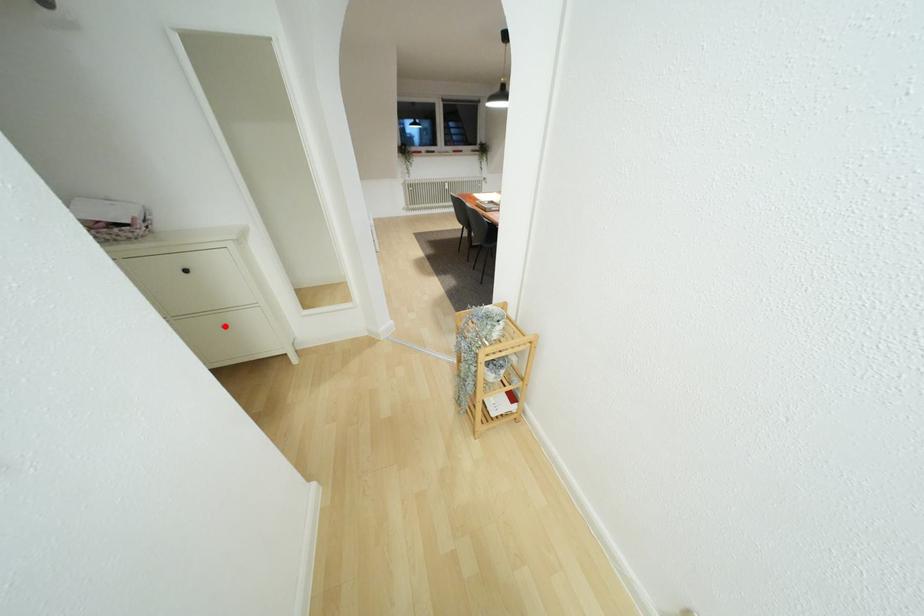
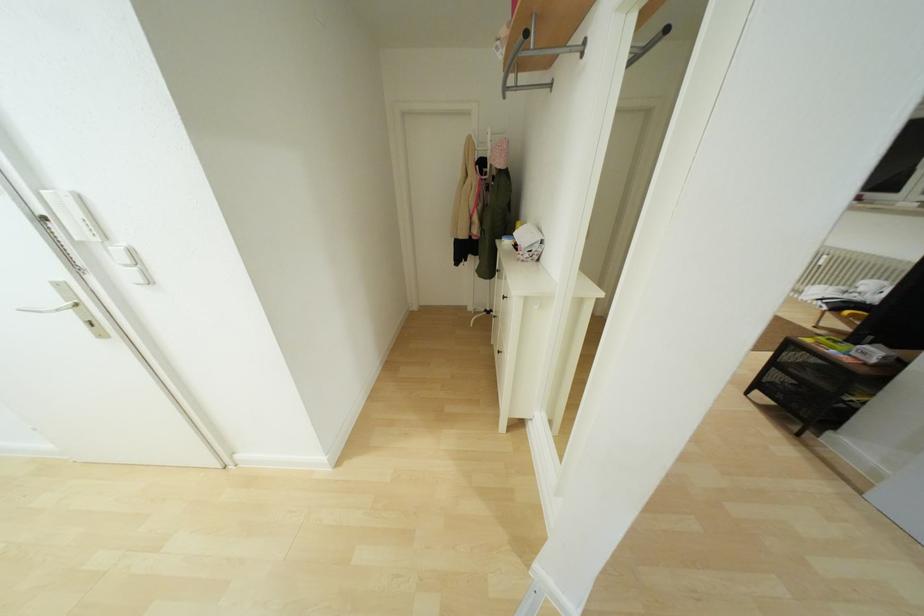
Question: I am providing you with two images of the same scene from different viewpoints. A red point is marked on the first image. At the location where the point appears in image 1, is it still visible in image 2?

Choices:
 (A) Yes
 (B) No

Answer: (A)